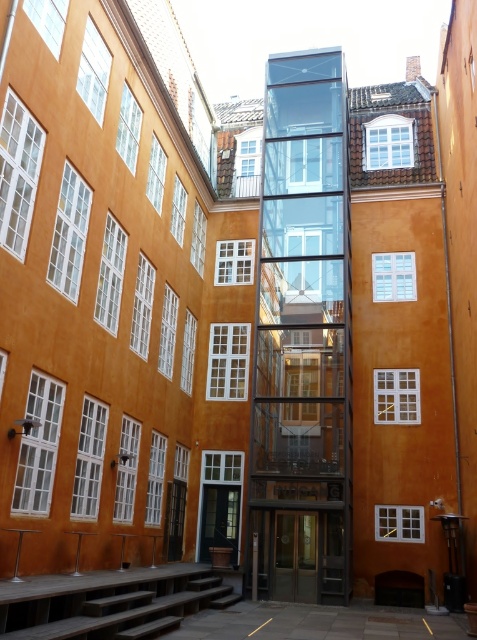
You are standing at the center of the courtyard and want to go down the dark brown wooden stairs at lower left. Which direction should you walk to reach the point marked by the coordinates point (111, 604)?

The point (111, 604) is on the dark brown wooden stairs at lower left, so you should walk towards the lower left direction to reach it.